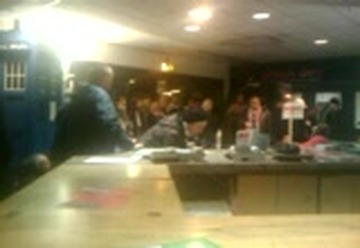
Where is `window`? Image resolution: width=360 pixels, height=248 pixels. window is located at coordinates (9, 69), (15, 69), (24, 69), (22, 84), (16, 85), (9, 84), (322, 99).